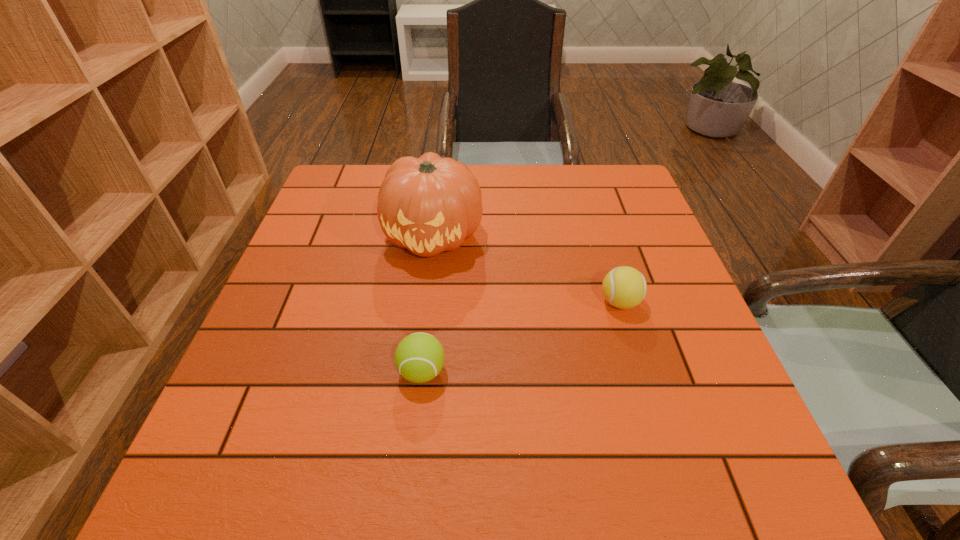
Identify the location of free space in the image that satisfies the following two spatial constraints: 1. on the carved face of the pumpkin; 2. on the right side of the nearest object. Image resolution: width=960 pixels, height=540 pixels. (418, 372).

This screenshot has height=540, width=960. I want to click on free space that satisfies the following two spatial constraints: 1. on the carved face of the farther tennis ball; 2. on the right side of the tallest object, so click(x=425, y=302).

Where is `free space that satisfies the following two spatial constraints: 1. on the carved face of the pumpkin; 2. on the left side of the left tennis ball`? free space that satisfies the following two spatial constraints: 1. on the carved face of the pumpkin; 2. on the left side of the left tennis ball is located at coordinates (418, 372).

Locate an element on the screen. Image resolution: width=960 pixels, height=540 pixels. free spot that satisfies the following two spatial constraints: 1. on the carved face of the farthest object; 2. on the left side of the rightmost object is located at coordinates (425, 302).

Where is `free space that satisfies the following two spatial constraints: 1. on the back side of the farther tennis ball; 2. on the right side of the nearer tennis ball`? Image resolution: width=960 pixels, height=540 pixels. free space that satisfies the following two spatial constraints: 1. on the back side of the farther tennis ball; 2. on the right side of the nearer tennis ball is located at coordinates (430, 302).

I want to click on free region that satisfies the following two spatial constraints: 1. on the carved face of the pumpkin; 2. on the left side of the nearer tennis ball, so (x=418, y=372).

Identify the location of free space that satisfies the following two spatial constraints: 1. on the back side of the farther tennis ball; 2. on the left side of the left tennis ball. The image size is (960, 540). (430, 302).